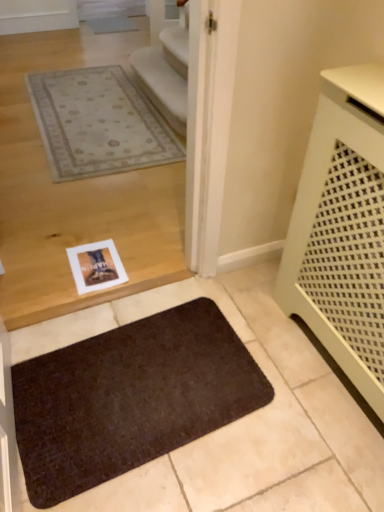
The width and height of the screenshot is (384, 512). Identify the location of free point in front of white perforated radiator at right. (304, 446).